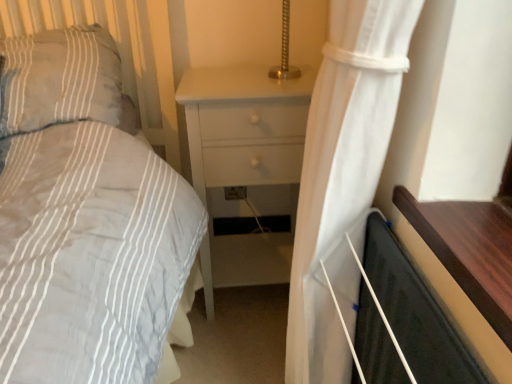
Question: Considering the relative positions of black matte screen door at lower right and white sheer curtain at right in the image provided, is black matte screen door at lower right to the left of white sheer curtain at right from the viewer's perspective?

Choices:
 (A) no
 (B) yes

Answer: (A)

Question: Is black matte screen door at lower right positioned with its back to white sheer curtain at right?

Choices:
 (A) yes
 (B) no

Answer: (A)

Question: Does black matte screen door at lower right come behind white sheer curtain at right?

Choices:
 (A) yes
 (B) no

Answer: (A)

Question: From a real-world perspective, is black matte screen door at lower right over white sheer curtain at right?

Choices:
 (A) yes
 (B) no

Answer: (B)

Question: Is black matte screen door at lower right not near white sheer curtain at right?

Choices:
 (A) no
 (B) yes

Answer: (A)

Question: Considering the relative sizes of black matte screen door at lower right and white sheer curtain at right in the image provided, is black matte screen door at lower right wider than white sheer curtain at right?

Choices:
 (A) yes
 (B) no

Answer: (B)

Question: Is black matte screen door at lower right completely or partially outside of white matte nightstand at center?

Choices:
 (A) yes
 (B) no

Answer: (A)

Question: Is black matte screen door at lower right facing away from white matte nightstand at center?

Choices:
 (A) yes
 (B) no

Answer: (B)

Question: From a real-world perspective, is black matte screen door at lower right physically below white matte nightstand at center?

Choices:
 (A) no
 (B) yes

Answer: (B)

Question: Does black matte screen door at lower right have a lesser height compared to white matte nightstand at center?

Choices:
 (A) no
 (B) yes

Answer: (B)

Question: Would you consider black matte screen door at lower right to be distant from white matte nightstand at center?

Choices:
 (A) no
 (B) yes

Answer: (A)

Question: Does black matte screen door at lower right come behind white matte nightstand at center?

Choices:
 (A) no
 (B) yes

Answer: (A)

Question: From a real-world perspective, is white sheer curtain at right below white matte nightstand at center?

Choices:
 (A) no
 (B) yes

Answer: (A)